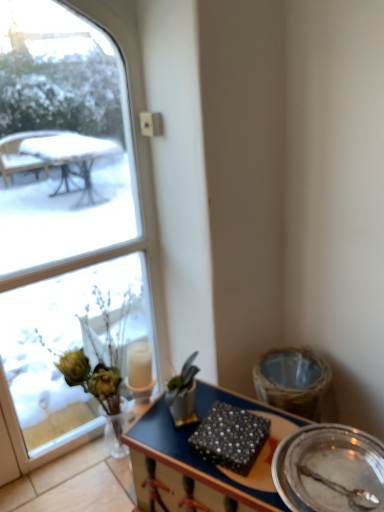
The image size is (384, 512). Find the location of `clear glass window at upper left`. clear glass window at upper left is located at coordinates (72, 217).

Identify the location of translucent glass vase at left. Image resolution: width=384 pixels, height=512 pixels. (100, 350).

This screenshot has height=512, width=384. What do you see at coordinates (230, 437) in the screenshot?
I see `pearl-patterned fabric at center` at bounding box center [230, 437].

Describe the element at coordinates (328, 467) in the screenshot. This screenshot has height=512, width=384. I see `metallic silver plate at lower right` at that location.

You are a GUI agent. You are given a task and a screenshot of the screen. Output one action in this format:
    pyautogui.click(x=<x>, y=<y>)
    Task: Click on the clear glass window at upper left
    The height and width of the screenshot is (512, 384).
    Given the screenshot: What is the action you would take?
    pyautogui.click(x=72, y=217)

From the image's perspective, is pearl-patterned fabric at center located beneath metallic silver plate at lower right?

Actually, pearl-patterned fabric at center appears above metallic silver plate at lower right in the image.

Does pearl-patterned fabric at center come behind metallic silver plate at lower right?

Yes.

Is pearl-patterned fabric at center aimed at metallic silver plate at lower right?

No.

Does point (209, 434) appear closer or farther from the camera than point (363, 479)?

Point (209, 434) appears to be farther away from the viewer than point (363, 479).

Does metallic silver plate at lower right come in front of translucent glass vase at left?

Yes.

Who is taller, metallic silver plate at lower right or translucent glass vase at left?

translucent glass vase at left.

Identify the location of plate below the translucent glass vase at left (from the image's perspective). (328, 467).

Based on the photo, between metallic silver plate at lower right and translucent glass vase at left, which one appears on the left side from the viewer's perspective?

translucent glass vase at left.

From a real-world perspective, does translucent glass vase at left stand above clear glass window at upper left?

No, from a real-world perspective, translucent glass vase at left is not above clear glass window at upper left.

Considering the relative sizes of translucent glass vase at left and clear glass window at upper left in the image provided, is translucent glass vase at left thinner than clear glass window at upper left?

Incorrect, the width of translucent glass vase at left is not less than that of clear glass window at upper left.

Where is `floral arrangement that is behind the clear glass window at upper left`? The height and width of the screenshot is (512, 384). floral arrangement that is behind the clear glass window at upper left is located at coordinates (100, 350).

What's the angular difference between translucent glass vase at left and clear glass window at upper left's facing directions?

The facing directions of translucent glass vase at left and clear glass window at upper left are 2.85 degrees apart.

Is point (184, 450) closer or farther from the camera than point (113, 105)?

Point (184, 450).

From the image's perspective, is wooden desk at center located above or below clear glass window at upper left?

From the image's perspective, wooden desk at center appears below clear glass window at upper left.

Between wooden desk at center and clear glass window at upper left, which one has more height?

With more height is clear glass window at upper left.

Is there a large distance between wooden desk at center and clear glass window at upper left?

No, there isn't a large distance between wooden desk at center and clear glass window at upper left.

The width and height of the screenshot is (384, 512). Find the location of `food behind the metallic silver plate at lower right`. food behind the metallic silver plate at lower right is located at coordinates (230, 437).

Is metallic silver plate at lower right next to pearl-patterned fabric at center?

metallic silver plate at lower right and pearl-patterned fabric at center are not in contact.

Which is behind, metallic silver plate at lower right or pearl-patterned fabric at center?

pearl-patterned fabric at center is more distant.

Can you tell me how much pearl-patterned fabric at center and clear glass window at upper left differ in facing direction?

64.9 degrees.

From a real-world perspective, which is physically below, pearl-patterned fabric at center or clear glass window at upper left?

From a 3D spatial view, pearl-patterned fabric at center is below.

From the image's perspective, would you say pearl-patterned fabric at center is shown under clear glass window at upper left?

Indeed, from the image's perspective, pearl-patterned fabric at center is shown beneath clear glass window at upper left.

Which is more to the right, metallic silver plate at lower right or clear glass window at upper left?

metallic silver plate at lower right.

The image size is (384, 512). I want to click on plate that is below the clear glass window at upper left (from the image's perspective), so click(328, 467).

Between metallic silver plate at lower right and clear glass window at upper left, which one is positioned in front?

metallic silver plate at lower right is more forward.

Where is `food behind the metallic silver plate at lower right`? This screenshot has width=384, height=512. food behind the metallic silver plate at lower right is located at coordinates (230, 437).

The image size is (384, 512). In order to click on plate on the right of translucent glass vase at left in this screenshot , I will do `click(328, 467)`.

Based on their spatial positions, is translucent glass vase at left or wooden desk at center further from pearl-patterned fabric at center?

translucent glass vase at left is positioned further to the anchor pearl-patterned fabric at center.

Based on the photo, considering their positions, is translucent glass vase at left positioned further to metallic silver plate at lower right than wooden desk at center?

translucent glass vase at left lies further to metallic silver plate at lower right than the other object.

From the image, which object appears to be nearer to translucent glass vase at left, pearl-patterned fabric at center or wooden desk at center?

The object closer to translucent glass vase at left is wooden desk at center.

From the image, which object appears to be farther from wooden desk at center, metallic silver plate at lower right or pearl-patterned fabric at center?

metallic silver plate at lower right.

Which object lies nearer to the anchor point metallic silver plate at lower right, wooden desk at center or translucent glass vase at left?

Among the two, wooden desk at center is located nearer to metallic silver plate at lower right.

Based on their spatial positions, is translucent glass vase at left or pearl-patterned fabric at center closer to clear glass window at upper left?

Among the two, translucent glass vase at left is located nearer to clear glass window at upper left.

Based on the photo, looking at the image, which one is located further to wooden desk at center, translucent glass vase at left or metallic silver plate at lower right?

translucent glass vase at left lies further to wooden desk at center than the other object.

Which object lies further to the anchor point pearl-patterned fabric at center, wooden desk at center or clear glass window at upper left?

clear glass window at upper left is further to pearl-patterned fabric at center.

I want to click on floral arrangement between clear glass window at upper left and wooden desk at center from top to bottom, so click(100, 350).

The height and width of the screenshot is (512, 384). Find the location of `floral arrangement located between clear glass window at upper left and metallic silver plate at lower right in the left-right direction`. floral arrangement located between clear glass window at upper left and metallic silver plate at lower right in the left-right direction is located at coordinates (100, 350).

Where is `desk between pearl-patterned fabric at center and metallic silver plate at lower right in the horizontal direction`? desk between pearl-patterned fabric at center and metallic silver plate at lower right in the horizontal direction is located at coordinates (192, 459).

In order to click on desk located between translucent glass vase at left and metallic silver plate at lower right in the left-right direction in this screenshot , I will do `click(192, 459)`.